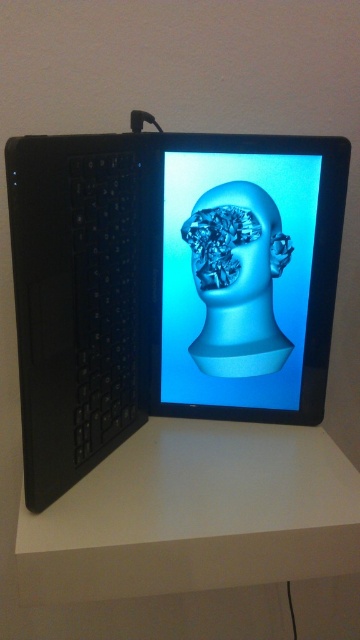
Question: Can you confirm if white matte table at center is positioned below translucent blue sculpture at center?

Choices:
 (A) no
 (B) yes

Answer: (B)

Question: Can you confirm if black matte laptop at center is positioned to the right of transparent plastic head at center?

Choices:
 (A) no
 (B) yes

Answer: (A)

Question: Does transparent plastic head at center have a greater width compared to translucent blue sculpture at center?

Choices:
 (A) no
 (B) yes

Answer: (B)

Question: Which of these objects is positioned farthest from the transparent plastic head at center?

Choices:
 (A) black matte laptop at center
 (B) white matte table at center
 (C) translucent blue sculpture at center

Answer: (B)

Question: Which object appears closest to the camera in this image?

Choices:
 (A) translucent blue sculpture at center
 (B) transparent plastic head at center
 (C) white matte table at center

Answer: (C)

Question: Considering the real-world distances, which object is farthest from the white matte table at center?

Choices:
 (A) translucent blue sculpture at center
 (B) black matte laptop at center
 (C) transparent plastic head at center

Answer: (A)